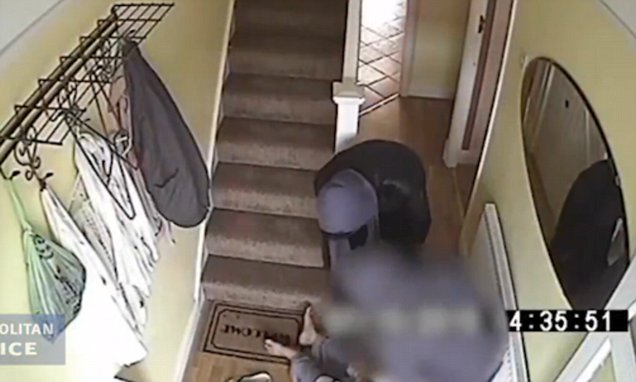
Locate an element on the screen. This screenshot has height=382, width=636. coat hangers is located at coordinates 116,44, 60,129, 38,179, 106,65.